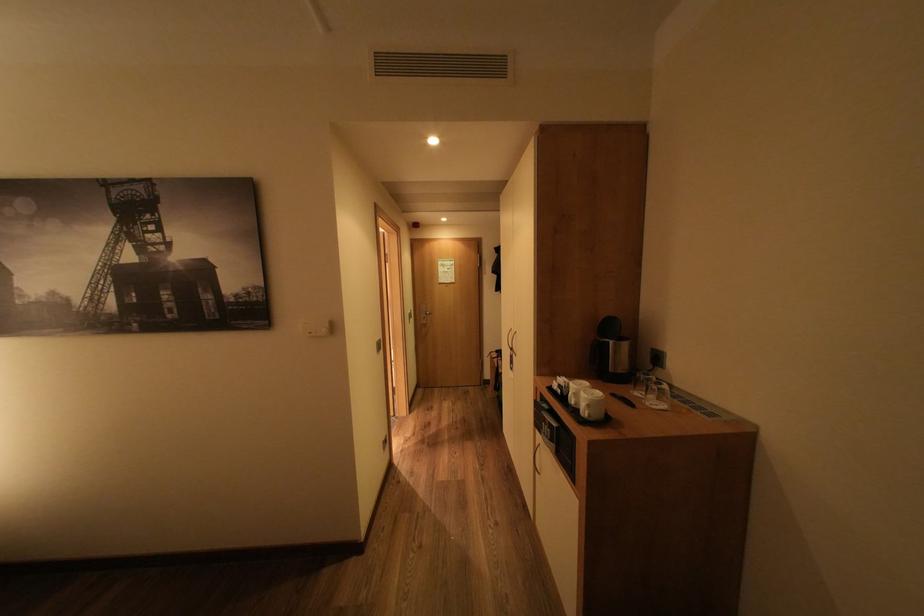
Find where to pull the metallic door handle. Please return your answer as a coordinate pair (x, y).

(423, 314)